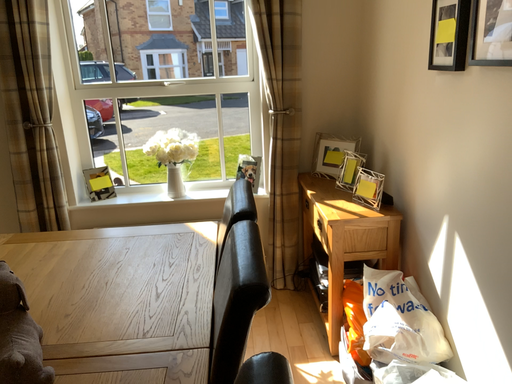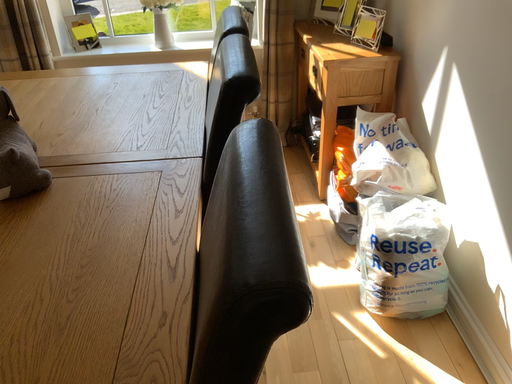
Question: Which way did the camera rotate in the video?

Choices:
 (A) rotated upward
 (B) rotated downward

Answer: (B)